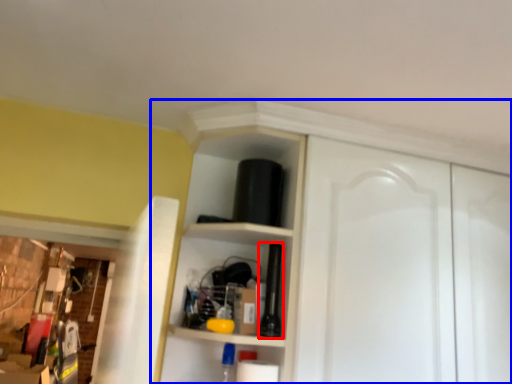
Question: Which object is closer to the camera taking this photo, bottle (highlighted by a red box) or dresser (highlighted by a blue box)?

Choices:
 (A) bottle
 (B) dresser

Answer: (B)